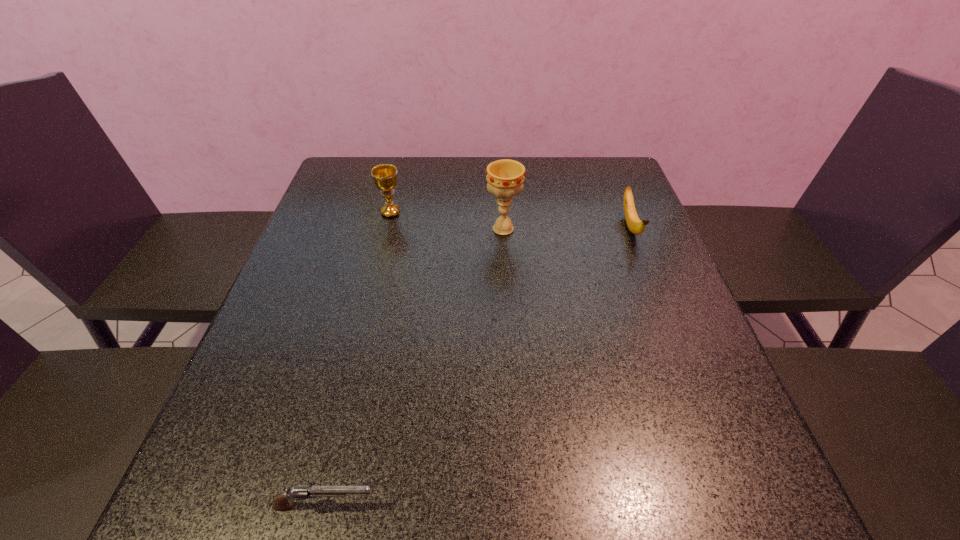
Identify the location of vacant point located 0.270m at the stem of the second shortest object. (673, 335).

Find the location of a particular element. Image resolution: width=960 pixels, height=540 pixels. free space located 0.390m aiming along the barrel of the nearest object is located at coordinates (637, 505).

Where is `object positioned at the near edge`? Image resolution: width=960 pixels, height=540 pixels. object positioned at the near edge is located at coordinates (282, 501).

Locate an element on the screen. The width and height of the screenshot is (960, 540). object located in the left edge section of the desktop is located at coordinates (282, 501).

I want to click on object present at the right edge, so click(635, 225).

You are a GUI agent. You are given a task and a screenshot of the screen. Output one action in this format:
    pyautogui.click(x=<x>, y=<y>)
    Task: Click on the object located at the near left corner
    This screenshot has width=960, height=540.
    Given the screenshot: What is the action you would take?
    pyautogui.click(x=282, y=501)

In the image, there is a desktop. Where is `vacant space at the far edge`? The image size is (960, 540). vacant space at the far edge is located at coordinates (453, 192).

Find the location of a particular element. vacant space at the left edge is located at coordinates (289, 440).

Where is `vacant region at the right edge of the desktop`? vacant region at the right edge of the desktop is located at coordinates (647, 250).

In the image, there is a desktop. Where is `free space at the far left corner`? This screenshot has width=960, height=540. free space at the far left corner is located at coordinates (340, 165).